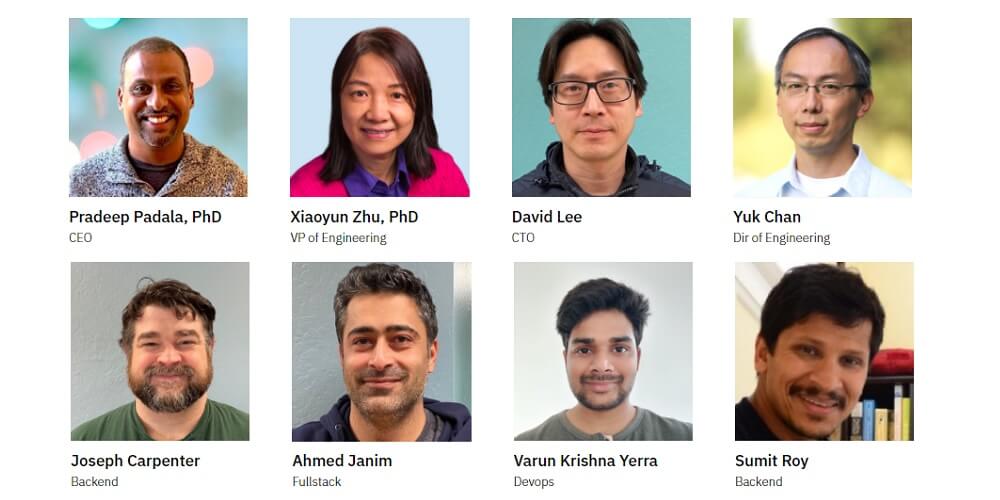
Find the location of `pictures on the top row`. pictures on the top row is located at coordinates (147, 94), (371, 110), (603, 111), (819, 110).